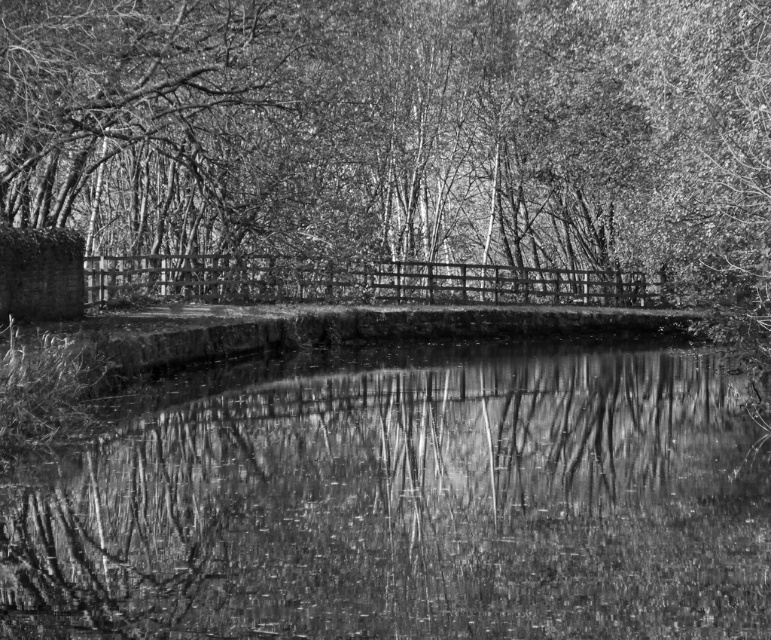
You are standing on the wooden bridge at center and looking down. Can you see the smooth water at center below you?

Yes, because the smooth water at center is in front of the wooden bridge at center, so it is located below the bridge and visible from your vantage point.